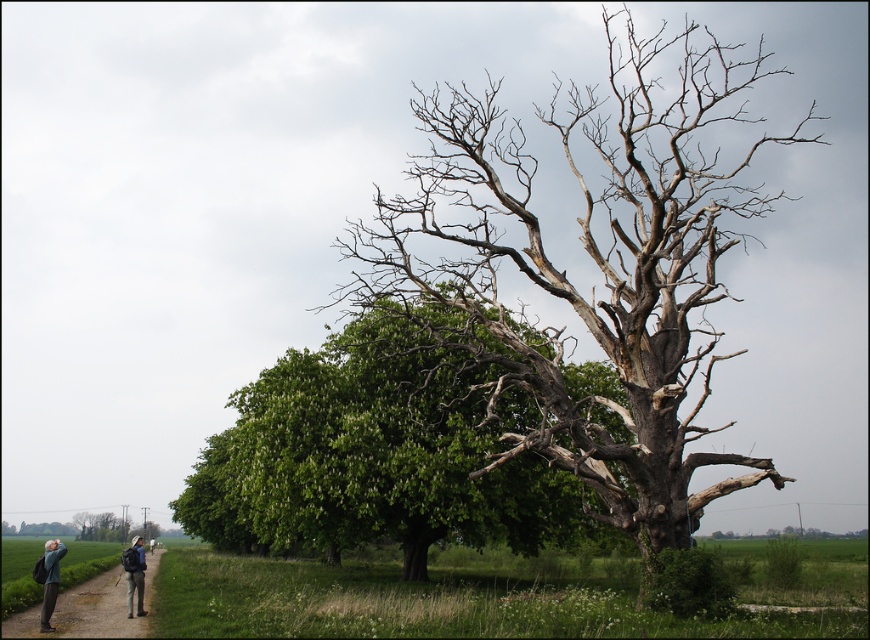
Who is shorter, green leafy tree at center or dark blue backpack at lower left?

Standing shorter between the two is dark blue backpack at lower left.

Between green leafy tree at center and dark blue backpack at lower left, which one appears on the right side from the viewer's perspective?

From the viewer's perspective, green leafy tree at center appears more on the right side.

What do you see at coordinates (375, 456) in the screenshot?
I see `green leafy tree at center` at bounding box center [375, 456].

The width and height of the screenshot is (870, 640). Find the location of `green leafy tree at center`. green leafy tree at center is located at coordinates (375, 456).

Between bare wood tree at center and green leafy tree at center, which one is positioned lower?

green leafy tree at center

Is point (696, 371) closer to camera compared to point (222, 548)?

Yes, it is in front of point (222, 548).

At what (x,y) coordinates should I click in order to perform the action: click on bare wood tree at center. Please return your answer as a coordinate pair (x, y). This screenshot has width=870, height=640. Looking at the image, I should click on (593, 264).

Is dark gray backpack at lower left taller than dark blue backpack at lower left?

Yes.

Is point (30, 611) in front of point (129, 611)?

No, (30, 611) is further to viewer.

Find the location of a particular element. The height and width of the screenshot is (640, 870). dark gray backpack at lower left is located at coordinates (84, 611).